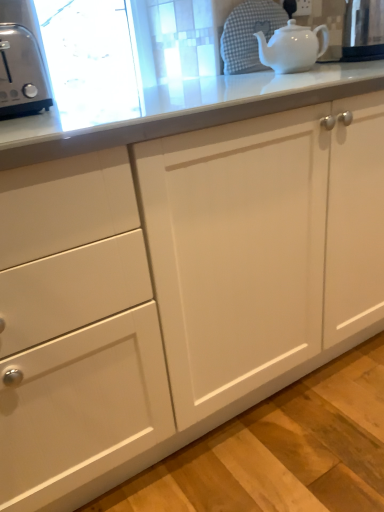
Question: In terms of height, does white glossy teapot at upper right look taller or shorter compared to metallic stainless steel kettle at upper right?

Choices:
 (A) short
 (B) tall

Answer: (A)

Question: Considering the positions of point (296, 57) and point (375, 50), is point (296, 57) closer or farther from the camera than point (375, 50)?

Choices:
 (A) closer
 (B) farther

Answer: (A)

Question: Estimate the real-world distances between objects in this image. Which object is closer to the satin silver toaster at left?

Choices:
 (A) metallic stainless steel kettle at upper right
 (B) white glossy teapot at upper right

Answer: (B)

Question: Based on their relative distances, which object is farther from the white glossy teapot at upper right?

Choices:
 (A) satin silver toaster at left
 (B) metallic stainless steel kettle at upper right

Answer: (A)